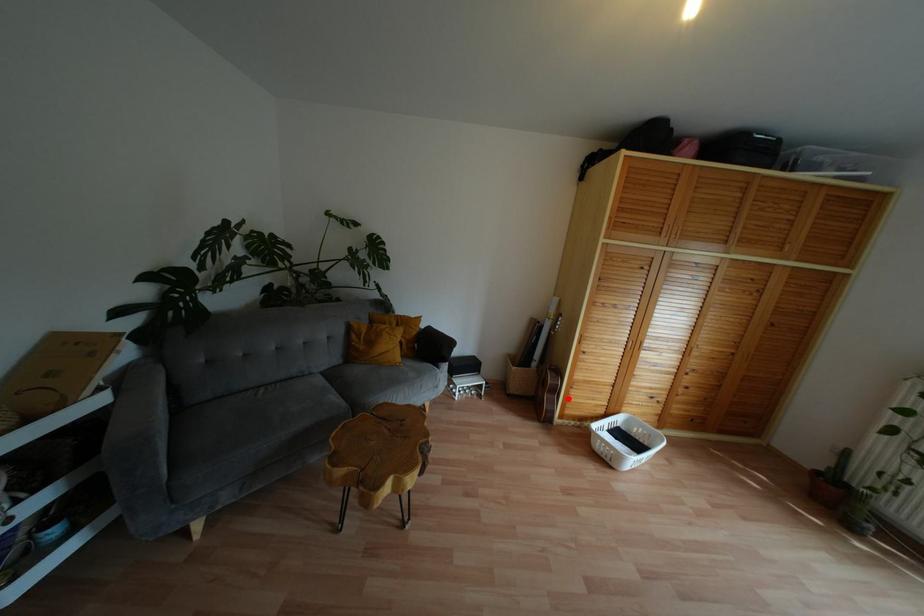
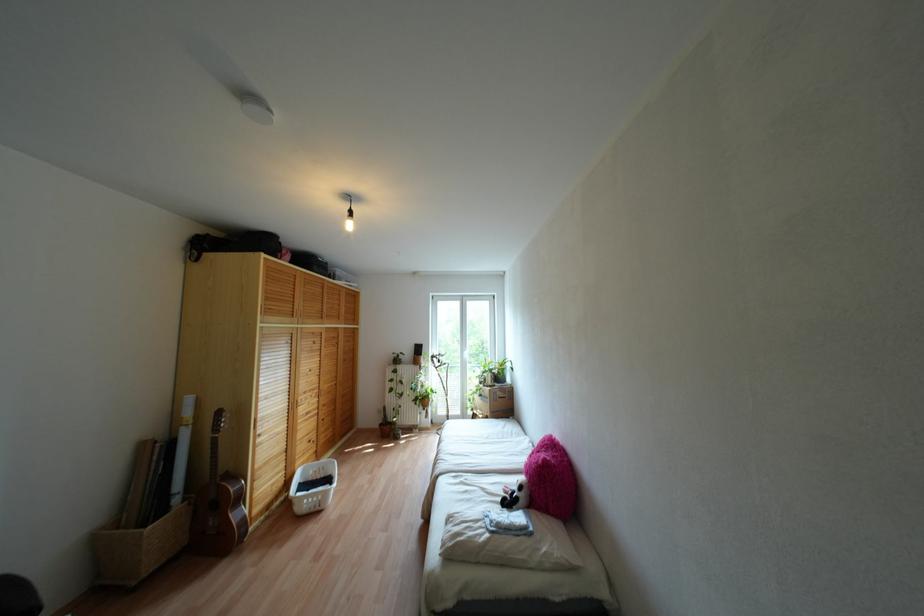
Where in the second image is the point corresponding to the highlighted location from the first image?

(253, 495)